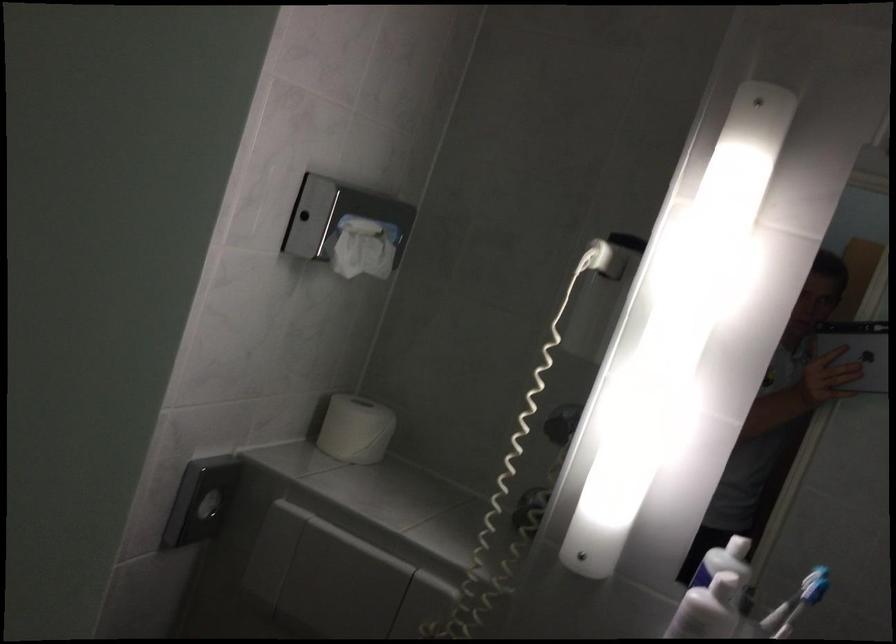
Which object does [355,429] point to?

It refers to a white toilet paper roll.